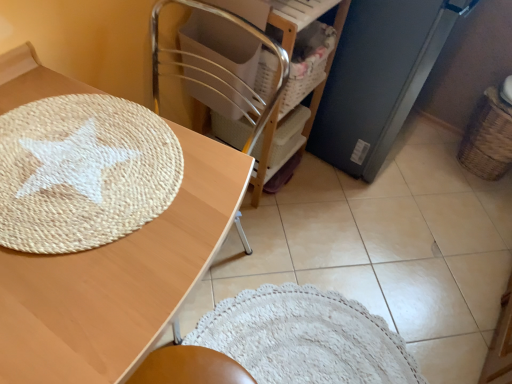
Locate an element on the screen. This screenshot has width=512, height=384. free space that is to the left of woven brown basket at right is located at coordinates (430, 157).